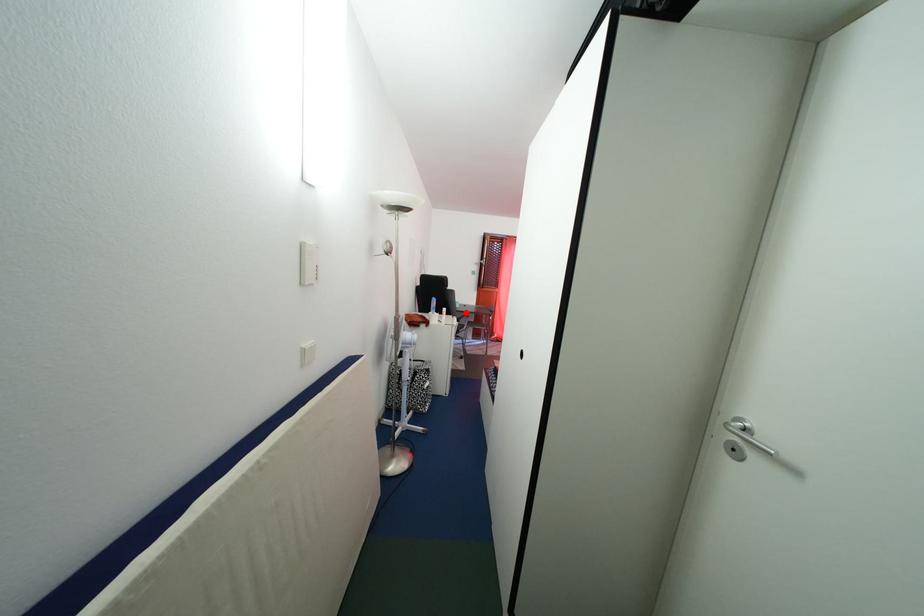
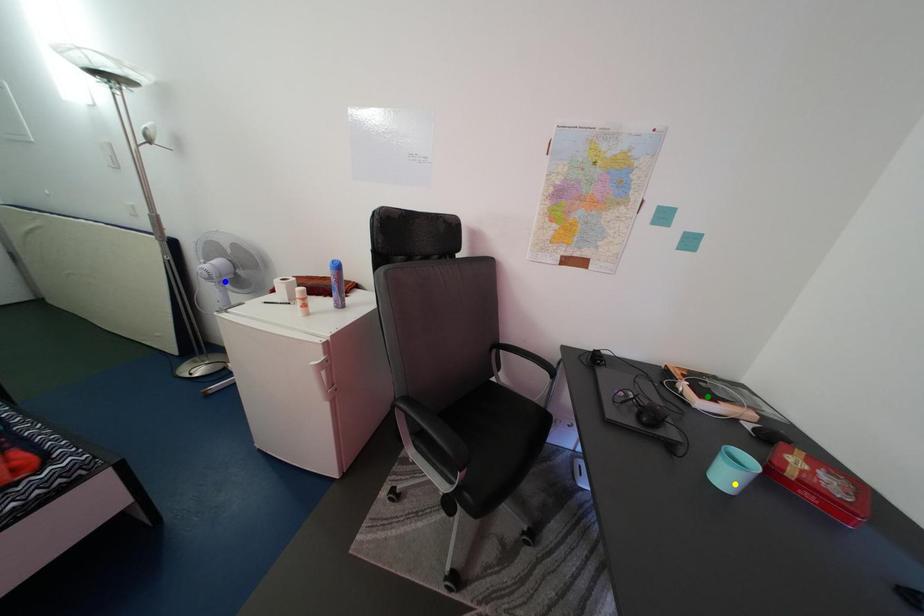
Question: I am providing you with two images of the same scene from different viewpoints. A red point is marked on the first image. You are given multiple points on the second image. In image 2, which mark is for the same physical point as the one in image 1?

Choices:
 (A) blue point
 (B) yellow point
 (C) green point

Answer: (B)